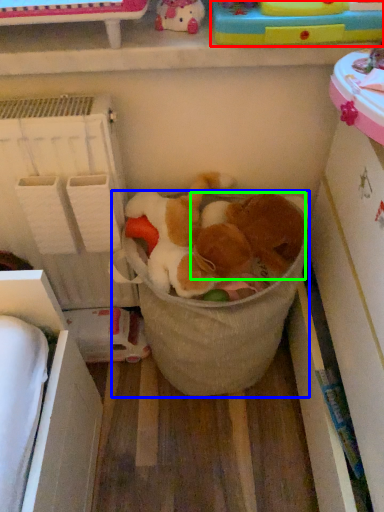
Question: Which is nearer to the toy (highlighted by a red box)? laundry basket (highlighted by a blue box) or animal (highlighted by a green box).

Choices:
 (A) laundry basket
 (B) animal

Answer: (B)